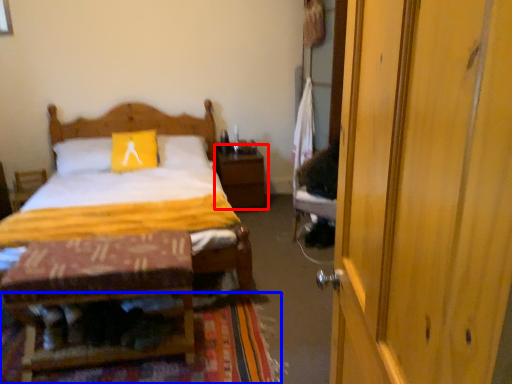
Question: Which point is closer to the camera, nightstand (highlighted by a red box) or mat (highlighted by a blue box)?

Choices:
 (A) nightstand
 (B) mat

Answer: (B)